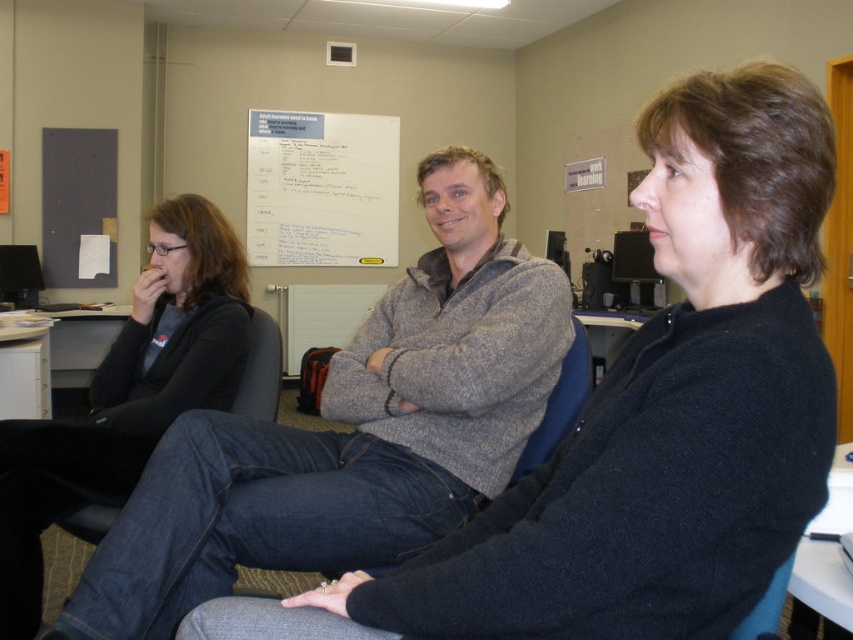
Question: Does dark blue sweater at center appear on the left side of gray sweater at center?

Choices:
 (A) no
 (B) yes

Answer: (A)

Question: Which of the following is the closest to the observer?

Choices:
 (A) dark blue sweater at center
 (B) white paperboard at upper center
 (C) gray sweater at center
 (D) black sweater at left

Answer: (A)

Question: Can you confirm if dark blue sweater at center is thinner than black sweater at left?

Choices:
 (A) no
 (B) yes

Answer: (A)

Question: Does dark blue sweater at center appear on the right side of white paperboard at upper center?

Choices:
 (A) yes
 (B) no

Answer: (A)

Question: Which object is positioned closest to the dark blue sweater at center?

Choices:
 (A) black sweater at left
 (B) gray sweater at center
 (C) white paperboard at upper center

Answer: (B)

Question: Which object appears farthest from the camera in this image?

Choices:
 (A) white paperboard at upper center
 (B) gray sweater at center

Answer: (A)